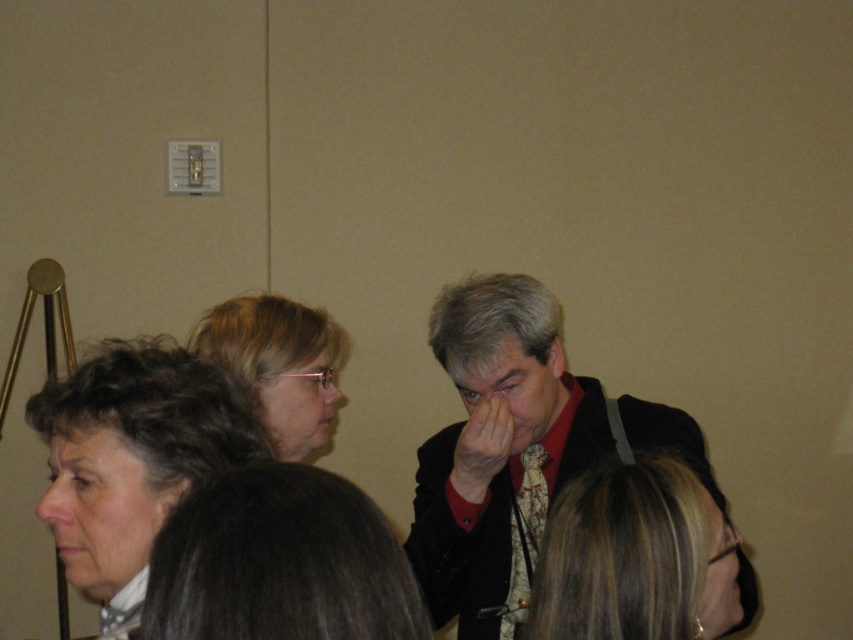
Does point (439, 560) come in front of point (379, 513)?

No, it is behind (379, 513).

Does dark red shirt at center appear under dark brown hair at center?

Yes, dark red shirt at center is below dark brown hair at center.

Which is in front, point (483, 516) or point (215, 490)?

Point (215, 490) is in front.

The width and height of the screenshot is (853, 640). In order to click on dark red shirt at center in this screenshot , I will do `click(515, 449)`.

How distant is dark brown hair at center from blonde hair at center?

They are 33.08 centimeters apart.

Does dark brown hair at center have a greater width compared to blonde hair at center?

No.

Consider the image. Who is more forward, (347, 561) or (564, 557)?

Point (347, 561) is more forward.

At what (x,y) coordinates should I click in order to perform the action: click on dark brown hair at center. Please return your answer as a coordinate pair (x, y). Looking at the image, I should click on (280, 563).

Is matte skin nose at lower left smaller than matte skin nose at center?

Incorrect, matte skin nose at lower left is not smaller in size than matte skin nose at center.

Can you confirm if matte skin nose at lower left is positioned to the right of matte skin nose at center?

No, matte skin nose at lower left is not to the right of matte skin nose at center.

Does point (62, 513) come behind point (332, 387)?

No.

Locate an element on the screen. This screenshot has width=853, height=640. matte skin nose at lower left is located at coordinates (57, 502).